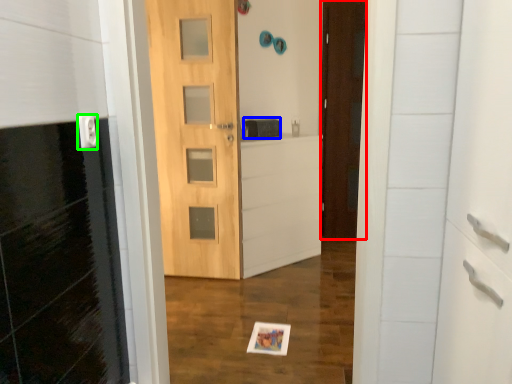
Question: Which object is positioned farthest from door (highlighted by a red box)? Select from medicine cabinet (highlighted by a blue box) and electric outlet (highlighted by a green box).

Choices:
 (A) medicine cabinet
 (B) electric outlet

Answer: (B)